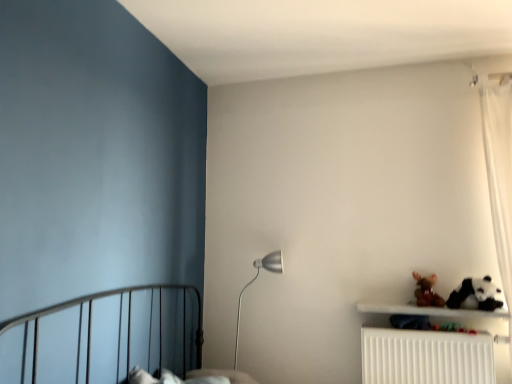
Question: Is point (462, 379) positioned closer to the camera than point (479, 299)?

Choices:
 (A) closer
 (B) farther

Answer: (A)

Question: Based on their positions, is white plastic radiator at lower right located to the left or right of white plush panda at lower right?

Choices:
 (A) right
 (B) left

Answer: (B)

Question: Which is nearer to the brown plush toy at upper right?

Choices:
 (A) white plastic radiator at lower right
 (B) silver metallic floor lamp at center
 (C) white plush panda at lower right

Answer: (C)

Question: Which object is positioned closest to the white plastic radiator at lower right?

Choices:
 (A) silver metallic floor lamp at center
 (B) white plush panda at lower right
 (C) brown plush toy at upper right

Answer: (C)